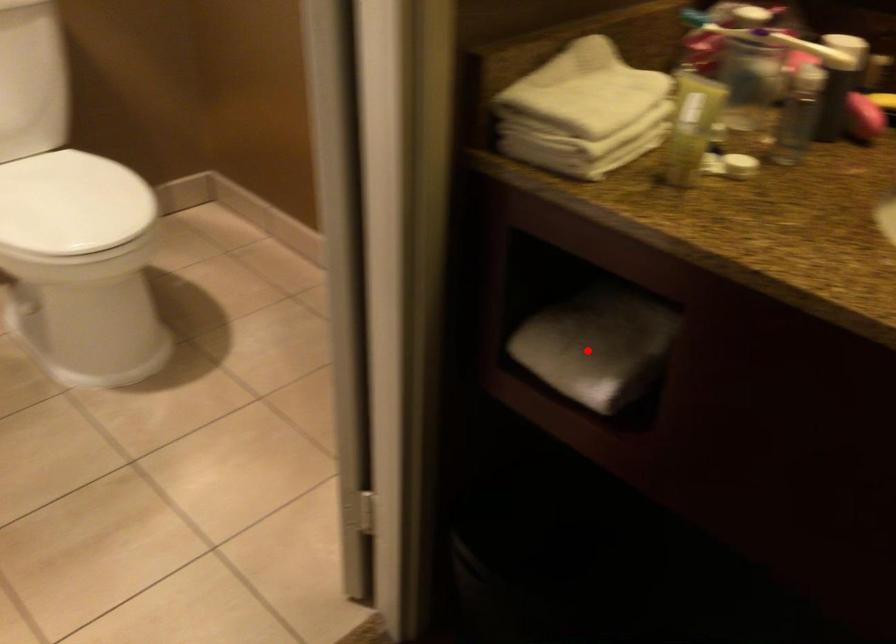
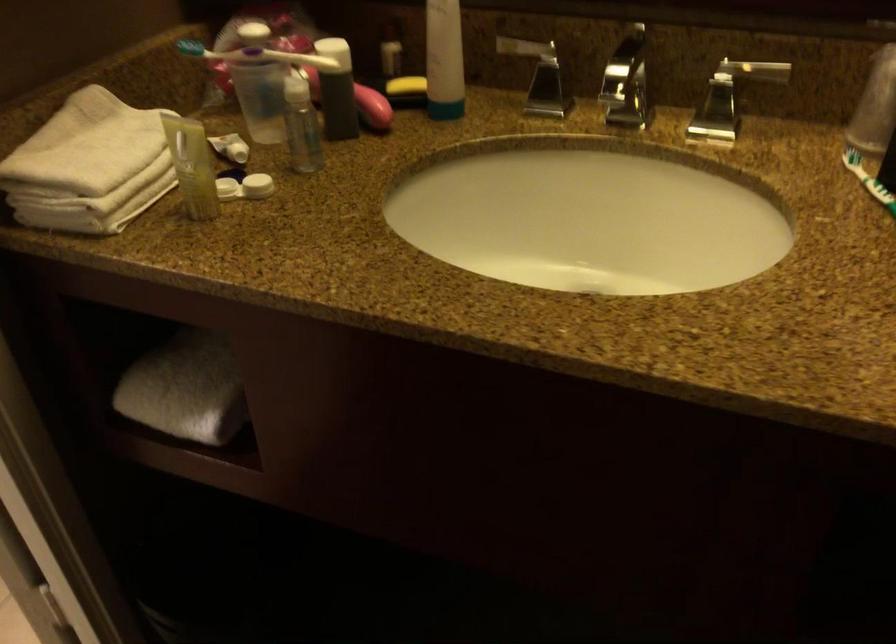
Find the pixel in the second image that matches the highlighted location in the first image.

(185, 389)